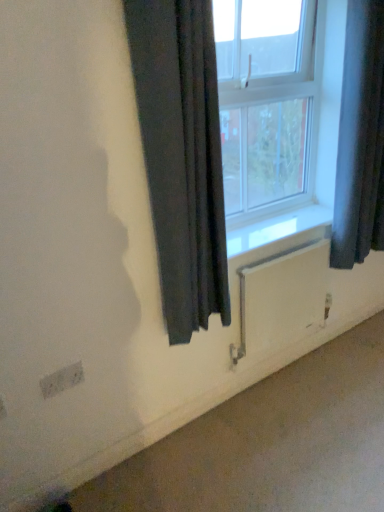
This screenshot has width=384, height=512. Identify the location of empty space that is ontop of white painted wood at lower center (from a real-world perspective). (269, 220).